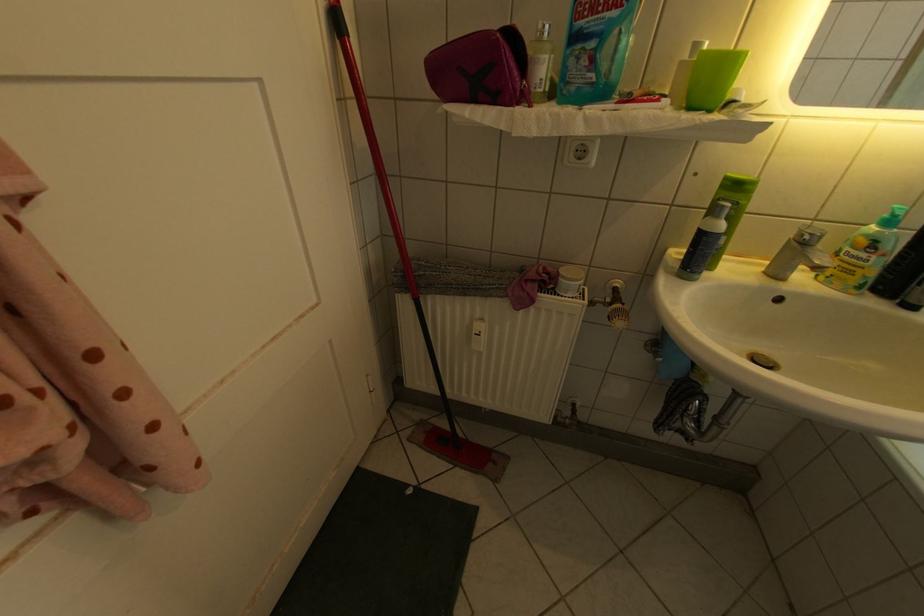
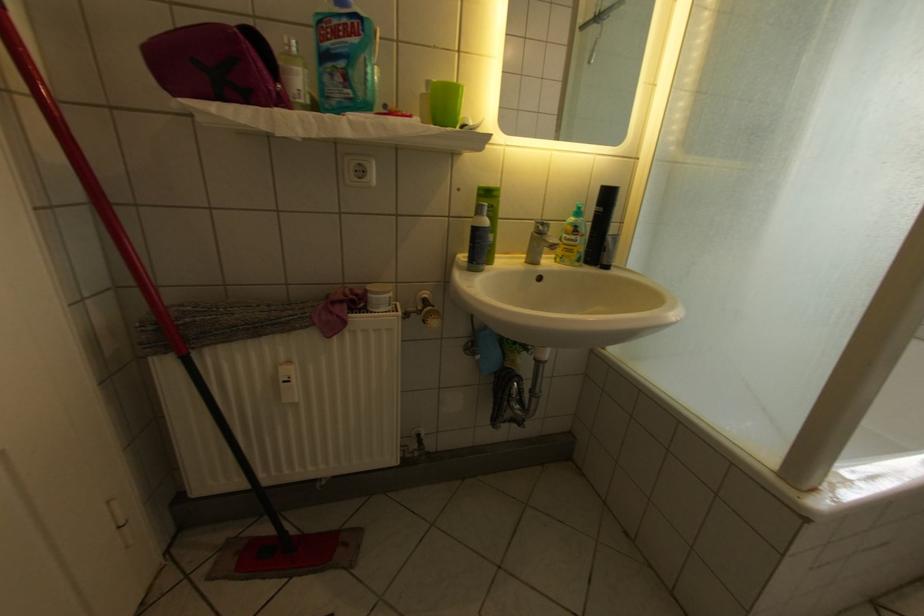
Where in the second image is the point corresponding to (x=694, y=65) from the first image?

(433, 98)